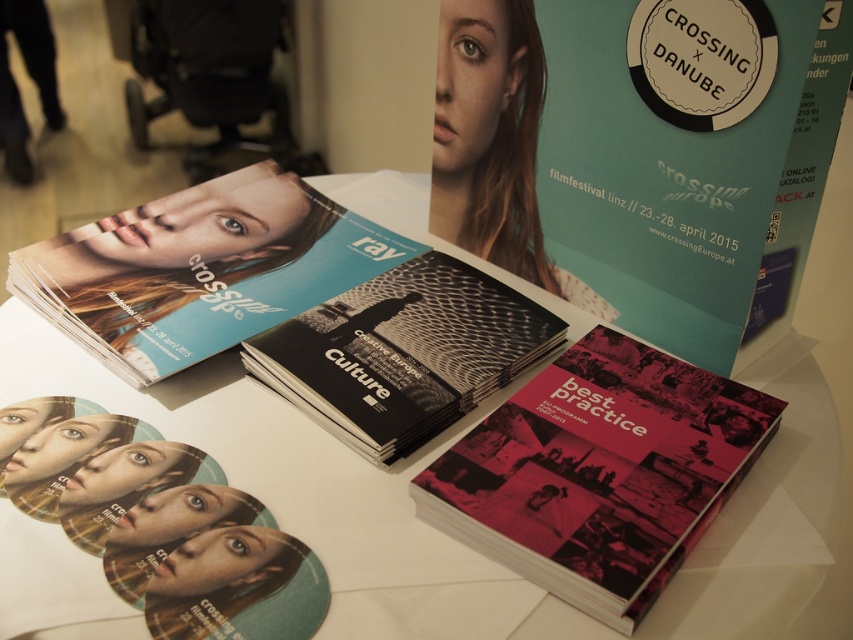
Question: Considering the real-world distances, which object is farthest from the black matte culture magazine at center?

Choices:
 (A) matte blue magazine at center
 (B) matte plastic circular stickers at lower left

Answer: (B)

Question: Which of the following is the closest to the observer?

Choices:
 (A) (286, 342)
 (B) (457, 476)

Answer: (B)

Question: Among these objects, which one is farthest from the camera?

Choices:
 (A) matte pink book at center
 (B) matte plastic circular stickers at lower left
 (C) matte blue magazine at center

Answer: (C)

Question: Does matte pink book at center have a smaller size compared to black matte culture magazine at center?

Choices:
 (A) yes
 (B) no

Answer: (B)

Question: Is the position of matte pink book at center less distant than that of black matte culture magazine at center?

Choices:
 (A) yes
 (B) no

Answer: (A)

Question: Can you confirm if matte pink book at center is positioned to the left of black matte culture magazine at center?

Choices:
 (A) no
 (B) yes

Answer: (A)